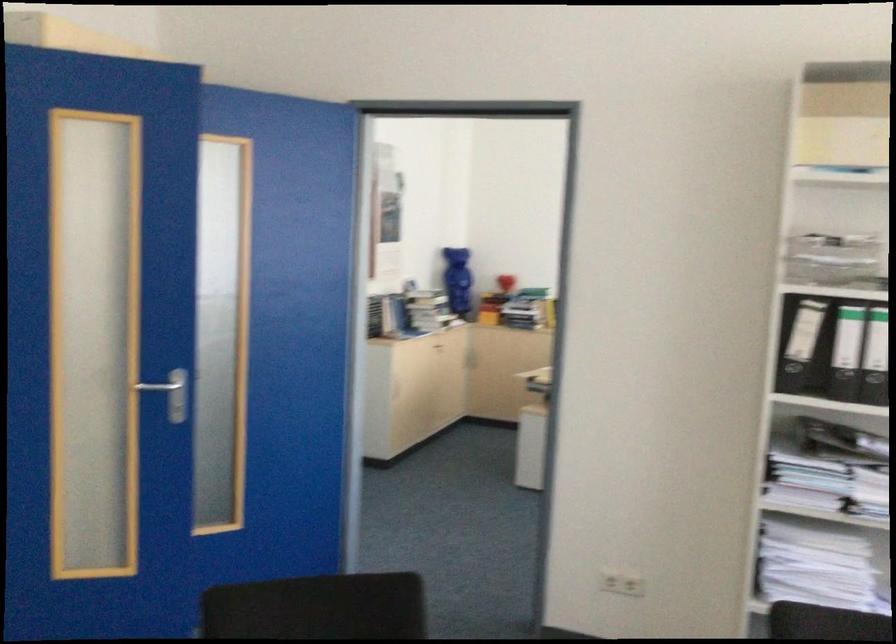
Find the location of `blue bear statue`. blue bear statue is located at coordinates (458, 279).